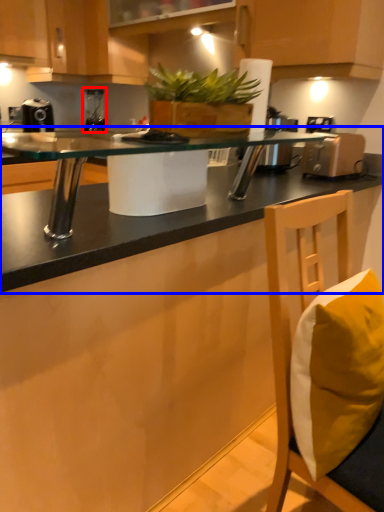
Question: Which point is closer to the camera, coffee machine (highlighted by a red box) or countertop (highlighted by a blue box)?

Choices:
 (A) coffee machine
 (B) countertop

Answer: (B)